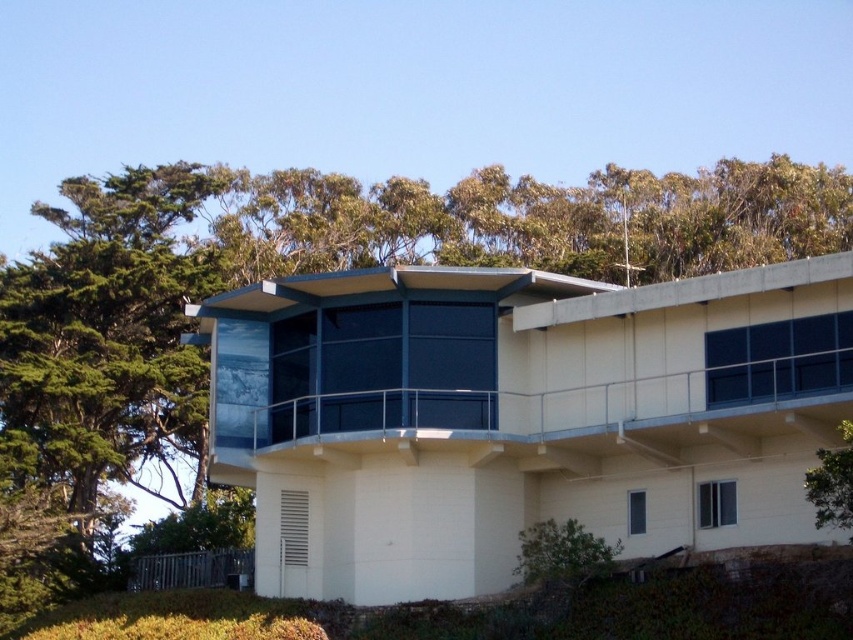
You are an architect designing a new garden layout. You need to place a large statue that requires a space bigger than the green leafy tree at upper left. Can the white smooth balcony at center accommodate it?

The green leafy tree at upper left is larger than the white smooth balcony at center, so the white smooth balcony at center cannot accommodate the statue since it is smaller than the tree.

You are standing at the base of the building and looking towards the balcony. There are two points marked on the structure. The first point is at coordinate point (260, 285) and the second is at coordinate point (757, 282). Which point would appear closer to you when viewed from your current position?

Point (757, 282) appears closer to you because it is in front of point (260, 285) according to their spatial arrangement.